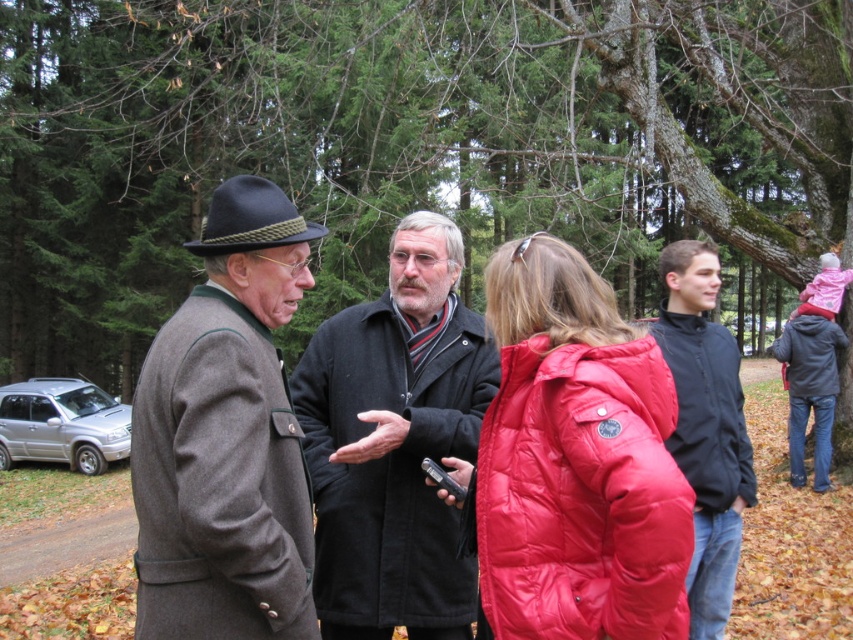
You are a photographer trying to capture a photo of the smooth bark tree at center and the black wool coat at center. Based on their positions, which object should you focus on first if you want to include both in your frame without moving the camera?

The smooth bark tree at center is positioned on the right side of black wool coat at center, so you should focus on the black wool coat at center first to ensure both are in the frame.

You are a photographer trying to capture a photo of the black wool coat at center and the dark blue felt plug hat at upper left. Based on their positions, which object should you focus on first to ensure both are in frame?

The dark blue felt plug hat at upper left should be focused on first since the black wool coat at center is located below it, ensuring both are within the frame when starting from the top.